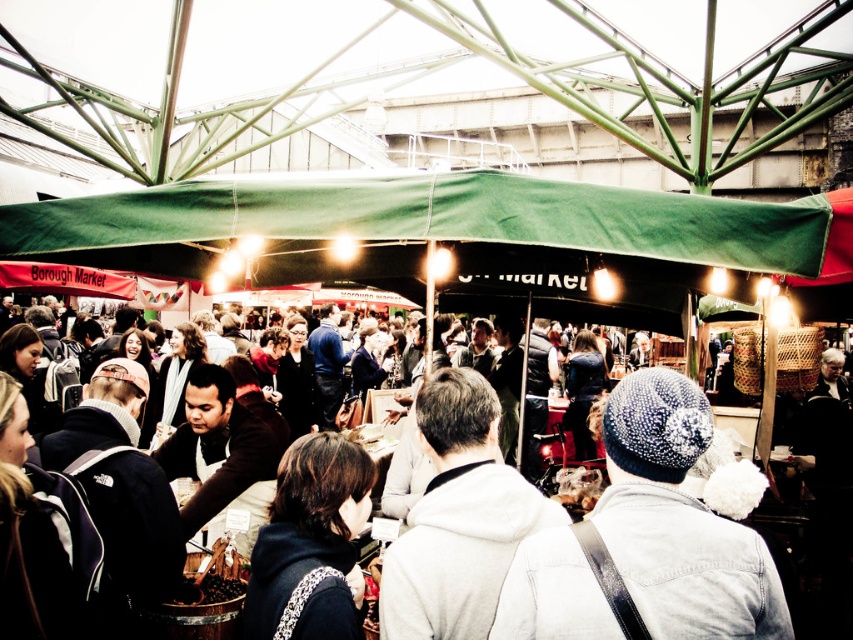
You are a vendor at the market and want to display a new item between the white knitted hat at center and the white fleece jacket at center. If the item requires 10 cm of space, can you fit it there?

The white knitted hat at center has a lesser width compared to white fleece jacket at center, but the exact distance between them isn not specified. Without knowing the space between them, it is impossible to determine if the item will fit.

You are a customer at the market and want to stay under the green fabric canopy at center while reaching for the white fleece jacket at center. Is the canopy providing shade over the jacket?

The green fabric canopy at center is positioned over the white fleece jacket at center, so yes, the canopy is providing shade over the jacket.

You are a photographer trying to capture the entire green fabric canopy at center and the white fleece jacket at center in one shot. Considering their sizes, which object should you focus on first to ensure both are in frame?

The green fabric canopy at center is bigger than the white fleece jacket at center, so you should focus on the green fabric canopy at center first to ensure both fit within the frame.